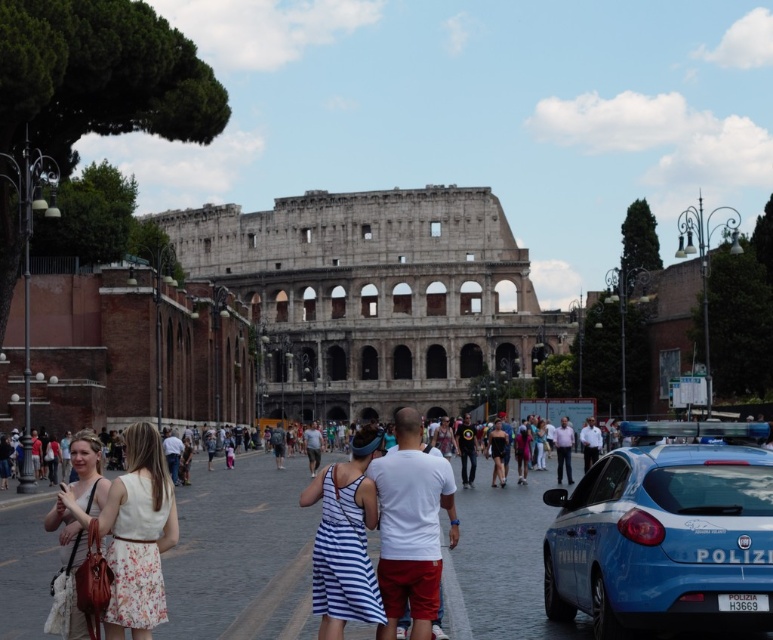
Question: Considering the real-world distances, which object is closest to the dark blue fabric dress at center?

Choices:
 (A) white striped dress at center
 (B) floral dress at lower left
 (C) white floral dress at lower left
 (D) gray stone amphitheater at center

Answer: (D)

Question: Is dark blue fabric dress at center smaller than white cotton shirt at center?

Choices:
 (A) no
 (B) yes

Answer: (B)

Question: Among these objects, which one is farthest from the camera?

Choices:
 (A) blue metallic car at right
 (B) white cotton shirt at center
 (C) dark blue fabric dress at center

Answer: (B)

Question: Does blue metallic car at right appear on the right side of floral dress at lower left?

Choices:
 (A) yes
 (B) no

Answer: (A)

Question: Considering the real-world distances, which object is closest to the dark blue fabric dress at center?

Choices:
 (A) white cotton shirt at center
 (B) gray stone amphitheater at center
 (C) white striped dress at center
 (D) white floral dress at lower left

Answer: (A)

Question: Can you confirm if gray stone amphitheater at center is wider than dark blue fabric dress at center?

Choices:
 (A) yes
 (B) no

Answer: (A)